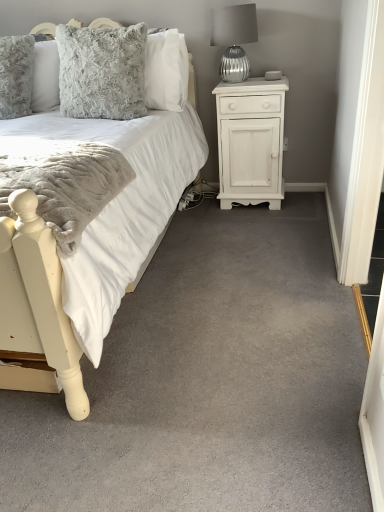
I want to click on unoccupied region to the right of white painted wood nightstand at right, so click(x=299, y=200).